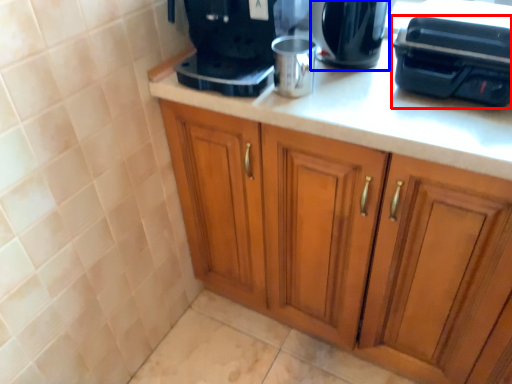
Question: Which point is closer to the camera, appliance (highlighted by a red box) or kitchen appliance (highlighted by a blue box)?

Choices:
 (A) appliance
 (B) kitchen appliance

Answer: (A)